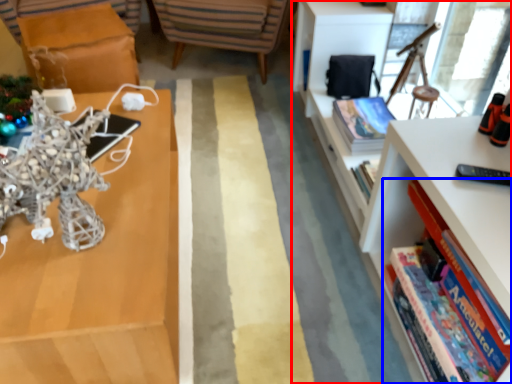
Question: Which object appears farthest to the camera in this image, bookcase (highlighted by a red box) or book (highlighted by a blue box)?

Choices:
 (A) bookcase
 (B) book

Answer: (B)